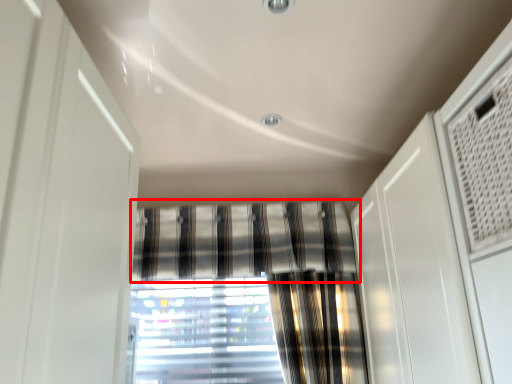
Question: Where is curtain (annotated by the red box) located in relation to window in the image?

Choices:
 (A) left
 (B) right

Answer: (B)